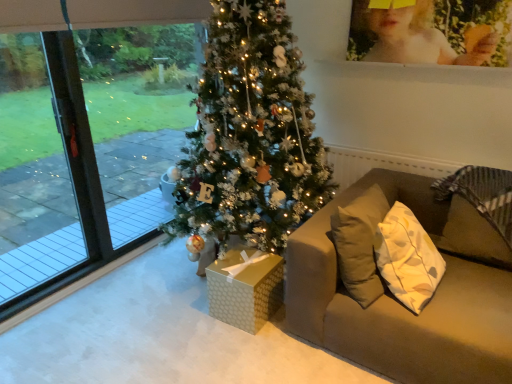
This screenshot has height=384, width=512. In order to click on free area below matte yellow photo frame at upper right (from a real-world perspective) in this screenshot , I will do `click(426, 65)`.